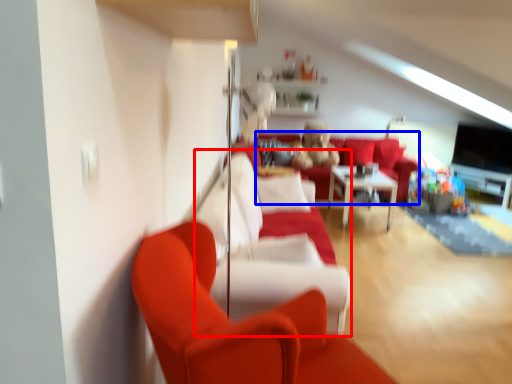
Question: Among these objects, which one is nearest to the camera, couch (highlighted by a red box) or couch (highlighted by a blue box)?

Choices:
 (A) couch
 (B) couch

Answer: (A)